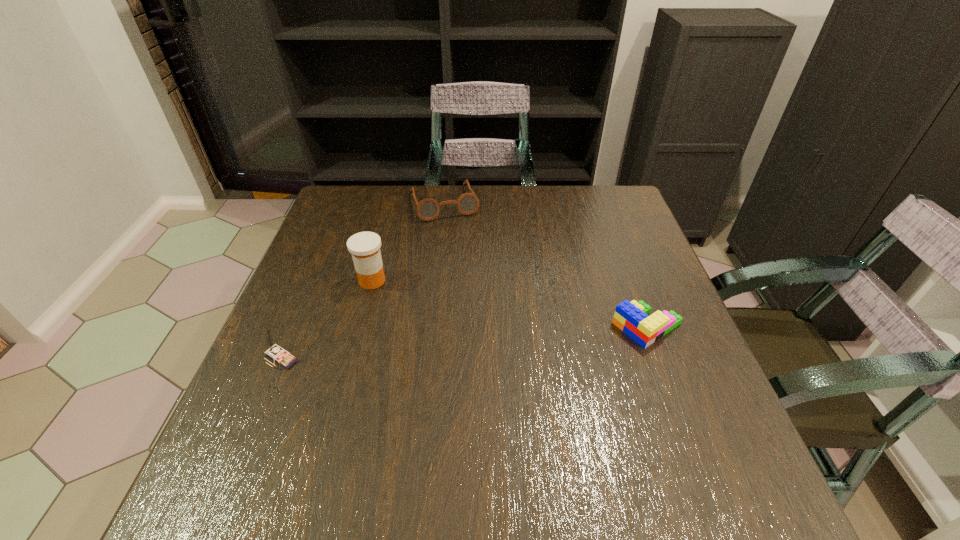
Where is `vacant region located 0.250m on the label of the medicine`? This screenshot has height=540, width=960. vacant region located 0.250m on the label of the medicine is located at coordinates (450, 347).

Locate an element on the screen. free region located 0.090m on the label of the medicine is located at coordinates (404, 307).

Locate an element on the screen. free space located on the front-facing side of the farthest object is located at coordinates click(x=484, y=310).

Identify the location of free spot located 0.180m on the front-facing side of the farthest object. (466, 261).

At what (x,y) coordinates should I click in order to perform the action: click on vacant region located on the front-facing side of the farthest object. Please return your answer as a coordinate pair (x, y). This screenshot has height=540, width=960. Looking at the image, I should click on (460, 247).

The width and height of the screenshot is (960, 540). In order to click on object situated at the far edge in this screenshot , I will do `click(427, 209)`.

The width and height of the screenshot is (960, 540). What are the coordinates of `matchbox that is positioned at the left edge` in the screenshot? It's located at (279, 355).

The image size is (960, 540). Find the location of `medicine at the left edge`. medicine at the left edge is located at coordinates (364, 246).

This screenshot has width=960, height=540. I want to click on object that is at the right edge, so click(632, 318).

Locate an element on the screen. free space at the far edge of the desktop is located at coordinates (519, 199).